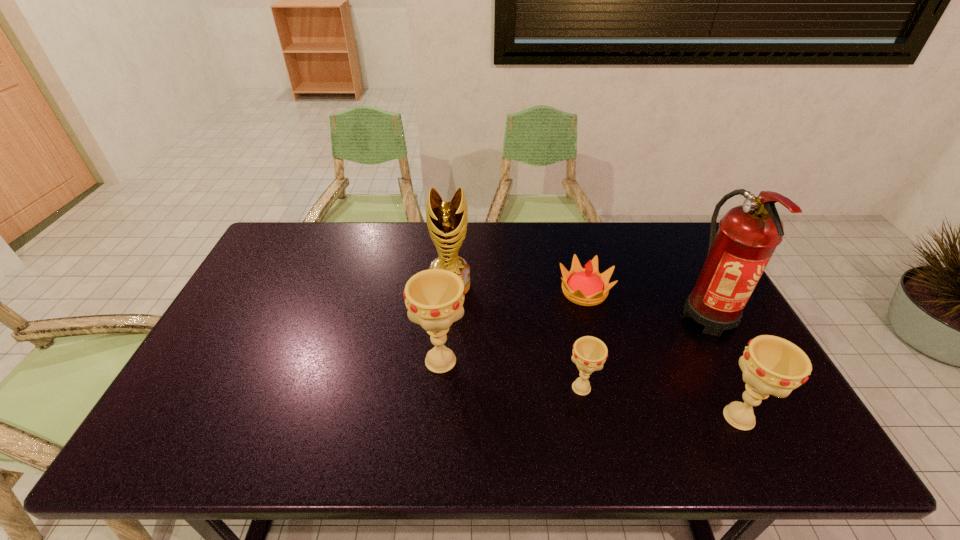
In the image, there is a desktop. Where is `vacant space at the right edge`? vacant space at the right edge is located at coordinates (676, 275).

Image resolution: width=960 pixels, height=540 pixels. What are the coordinates of `blank area at the far right corner` in the screenshot? It's located at (646, 233).

What are the coordinates of `vacant point located between the crown and the second shortest chalice` in the screenshot? It's located at (661, 355).

Locate an element on the screen. Image resolution: width=960 pixels, height=540 pixels. free space that is in between the shortest object and the tallest object is located at coordinates 646,303.

What are the coordinates of `vacant space that's between the fire extinguisher and the second shortest chalice` in the screenshot? It's located at (724, 366).

The width and height of the screenshot is (960, 540). I want to click on free space between the second tallest object and the fifth tallest object, so click(x=516, y=337).

This screenshot has height=540, width=960. Identify the location of free space between the second shortest object and the tallest object. (645, 352).

Locate an element on the screen. free space between the shortest object and the fire extinguisher is located at coordinates (646, 303).

Identify the location of vacant area that lies between the tallest object and the shortest chalice. (645, 352).

Locate an element on the screen. Image resolution: width=960 pixels, height=540 pixels. object that is the closest to the leftmost chalice is located at coordinates click(x=447, y=221).